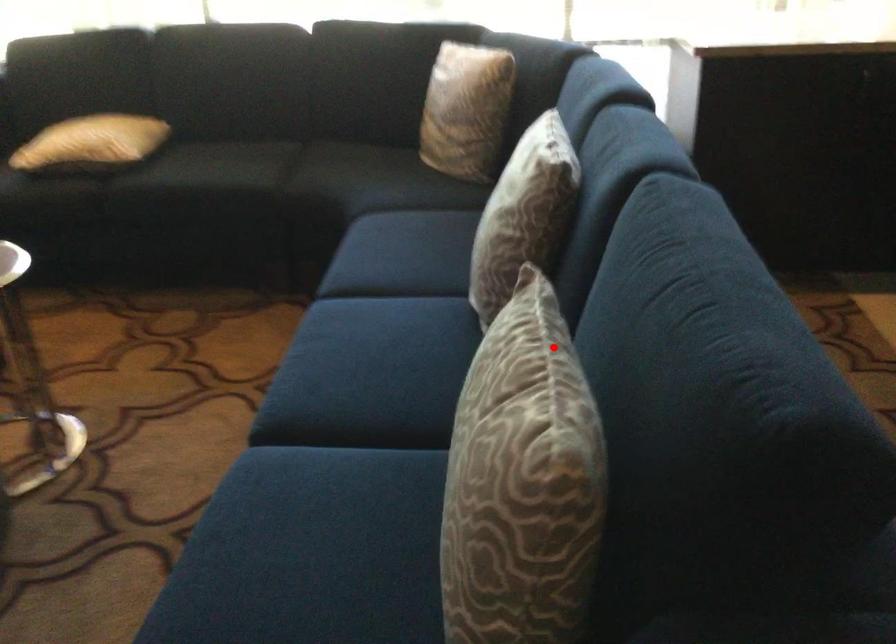
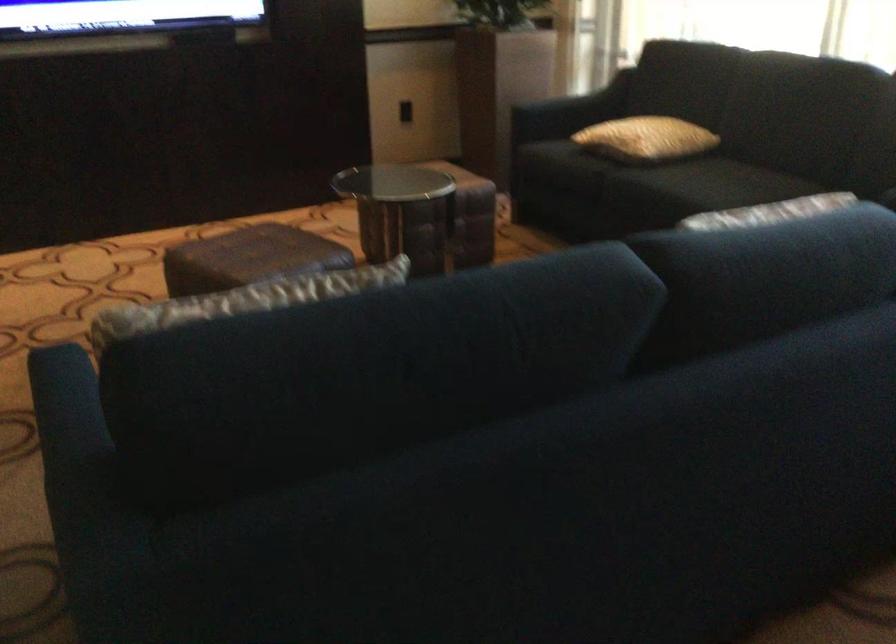
Locate, in the second image, the point that corresponds to the highlighted location in the first image.

(252, 298)